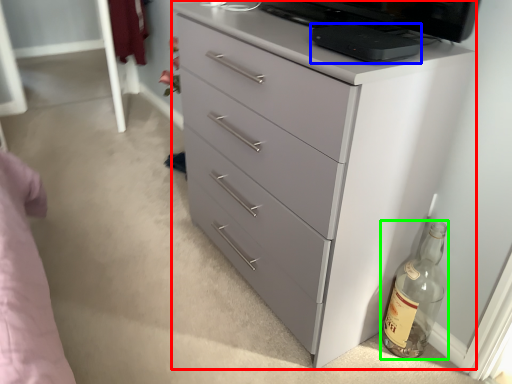
Question: Based on their relative distances, which object is farther from chest of drawers (highlighted by a red box)? Choose from appliance (highlighted by a blue box) and bottle (highlighted by a green box).

Choices:
 (A) appliance
 (B) bottle

Answer: (B)